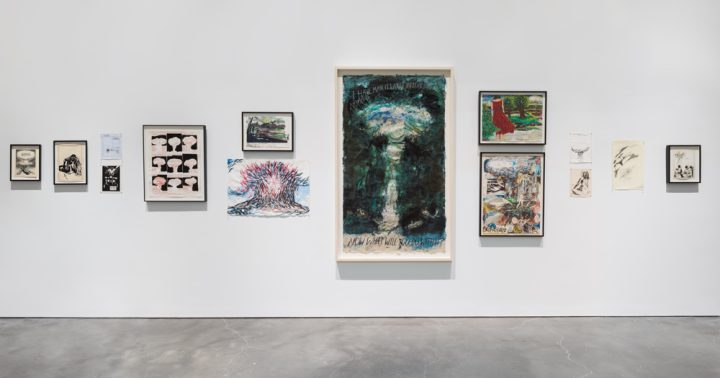
At what (x,y) coordinates should I click in order to perform the action: click on paintings. Please return your answer as a coordinate pair (x, y). The image size is (720, 378). Looking at the image, I should click on (408, 152).